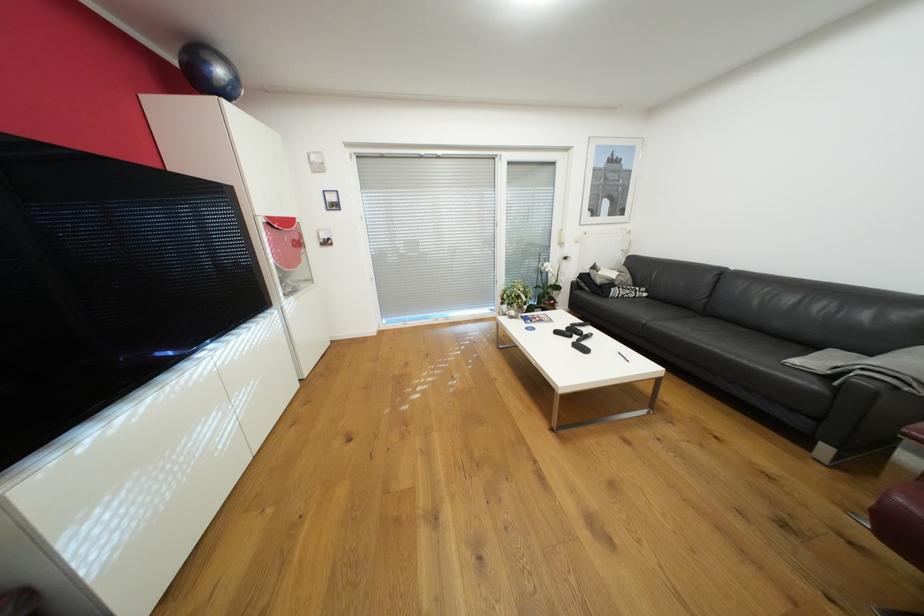
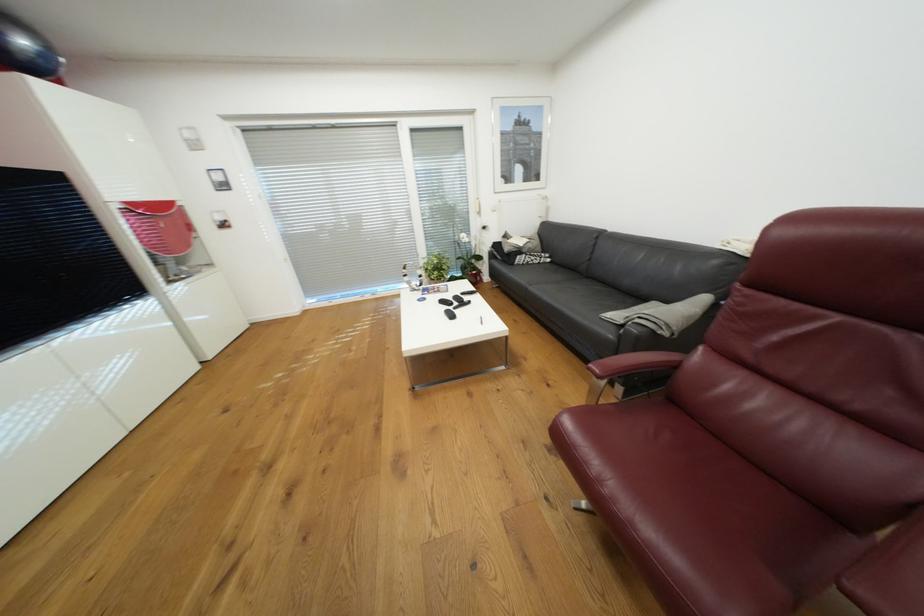
Where in the second image is the point corresponding to (565,331) from the first image?

(448, 302)